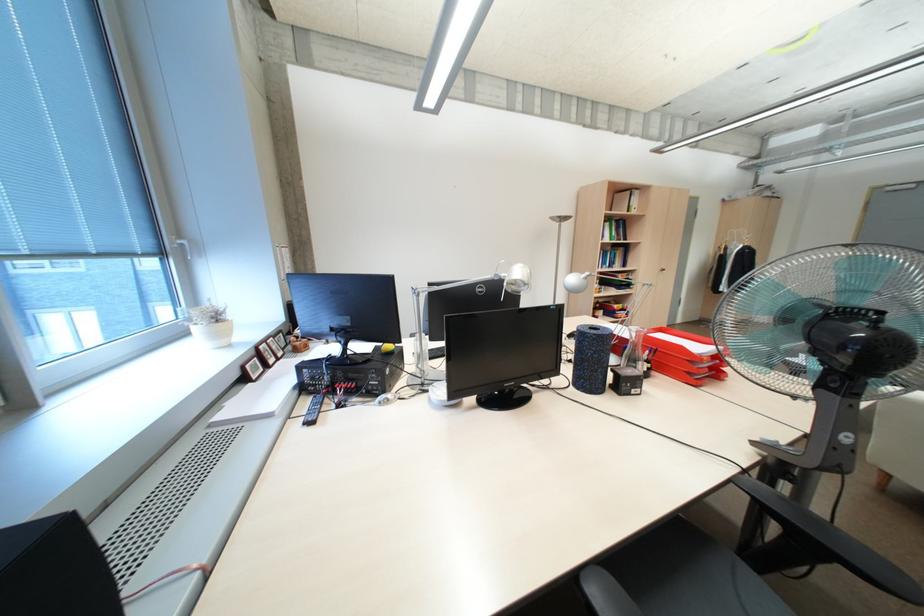
Where is `chair sitting surface`? The height and width of the screenshot is (616, 924). chair sitting surface is located at coordinates (691, 578).